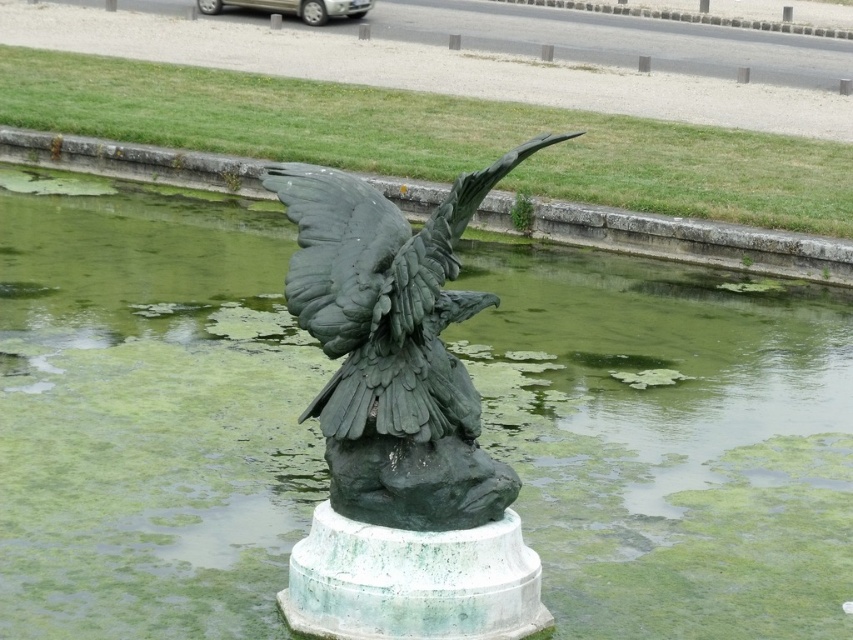
Question: Which point appears farthest from the camera in this image?

Choices:
 (A) (335, 262)
 (B) (654, 468)

Answer: (B)

Question: From the image, what is the correct spatial relationship of green algae water at center in relation to green patina eagle at center?

Choices:
 (A) right
 (B) left

Answer: (A)

Question: Is the position of green algae water at center less distant than that of green patina eagle at center?

Choices:
 (A) no
 (B) yes

Answer: (A)

Question: Does green algae water at center have a greater width compared to green patina eagle at center?

Choices:
 (A) no
 (B) yes

Answer: (A)

Question: Among these objects, which one is farthest from the camera?

Choices:
 (A) green algae water at center
 (B) green patina eagle at center

Answer: (A)